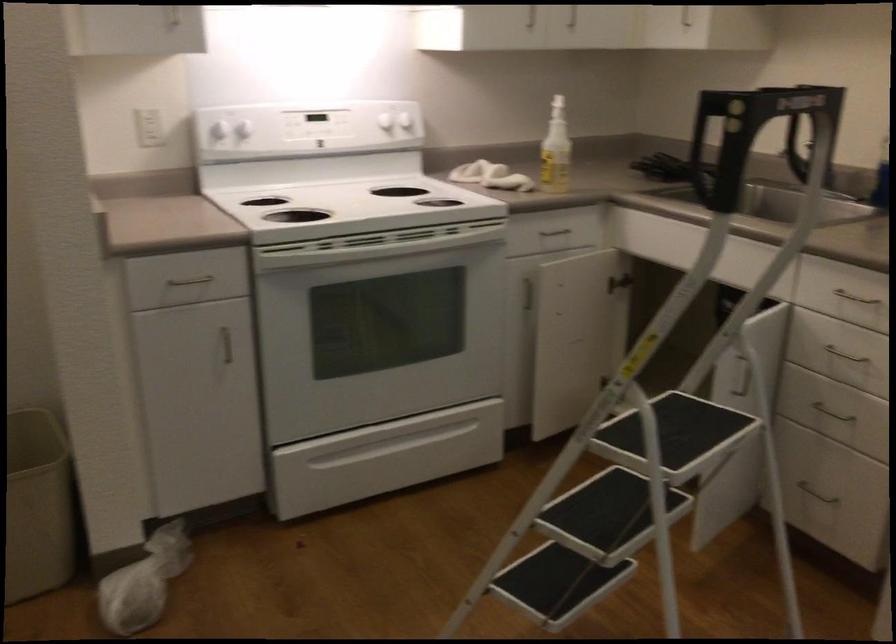
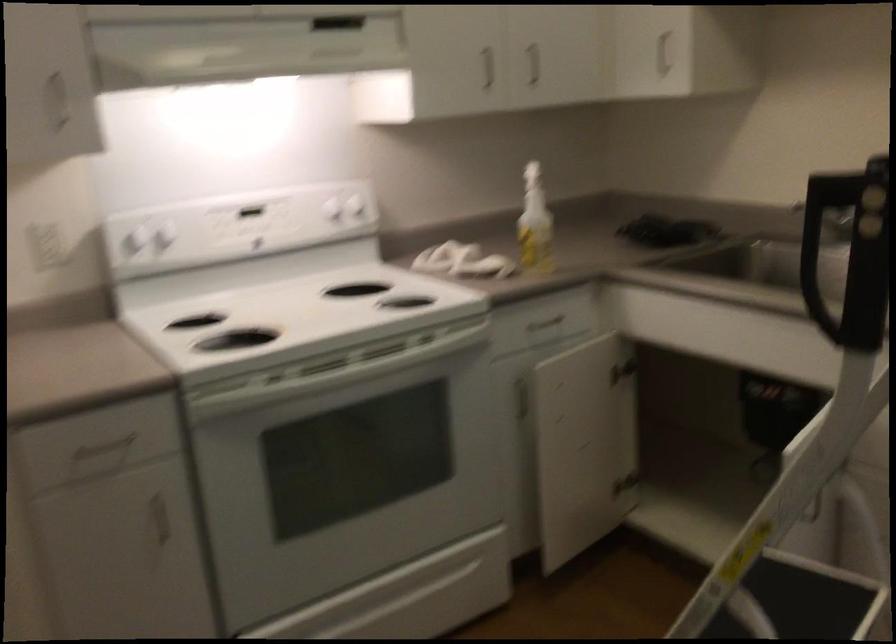
Find the pixel in the second image that matches point (383, 118) in the first image.

(332, 210)